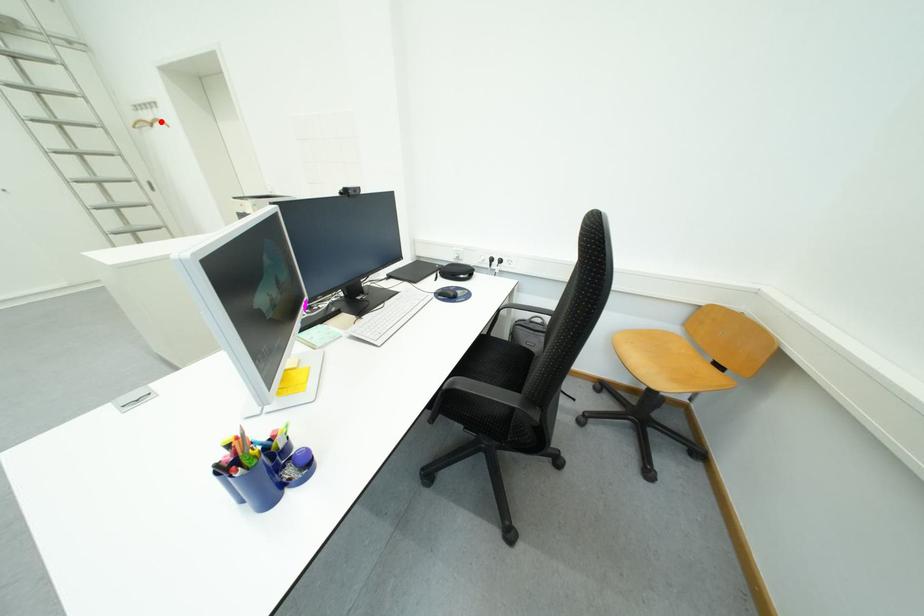
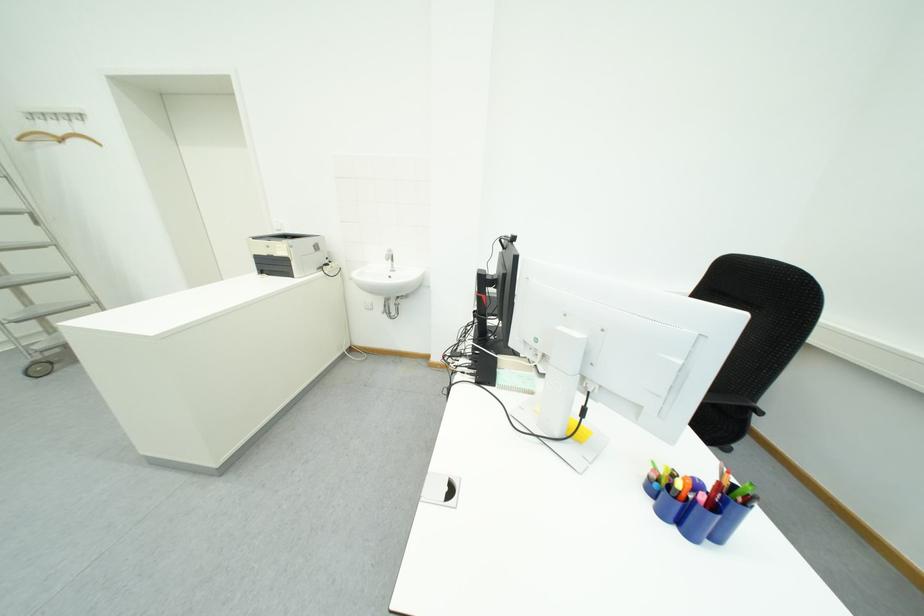
In the second image, find the point that corresponds to the highlighted location in the first image.

(69, 136)